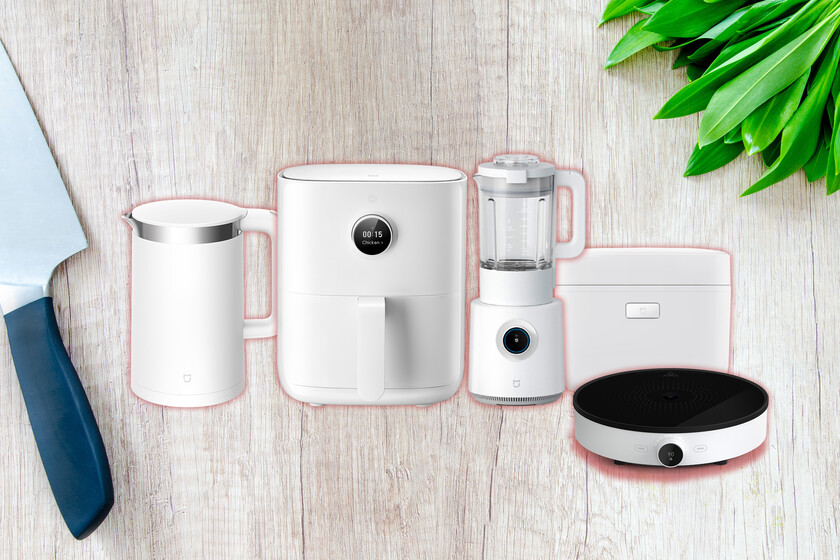
Where is `wood look wall paper`? The height and width of the screenshot is (560, 840). wood look wall paper is located at coordinates (329, 66).